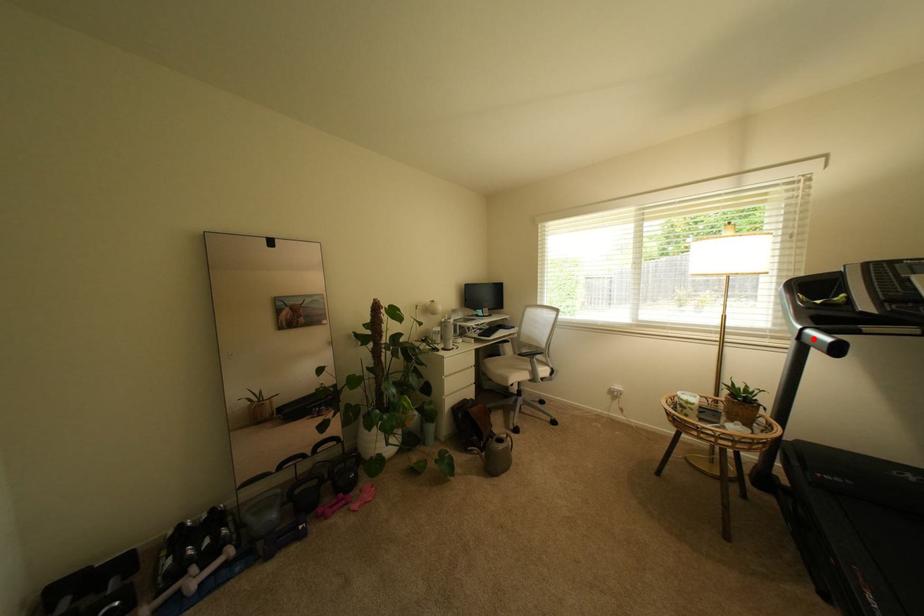
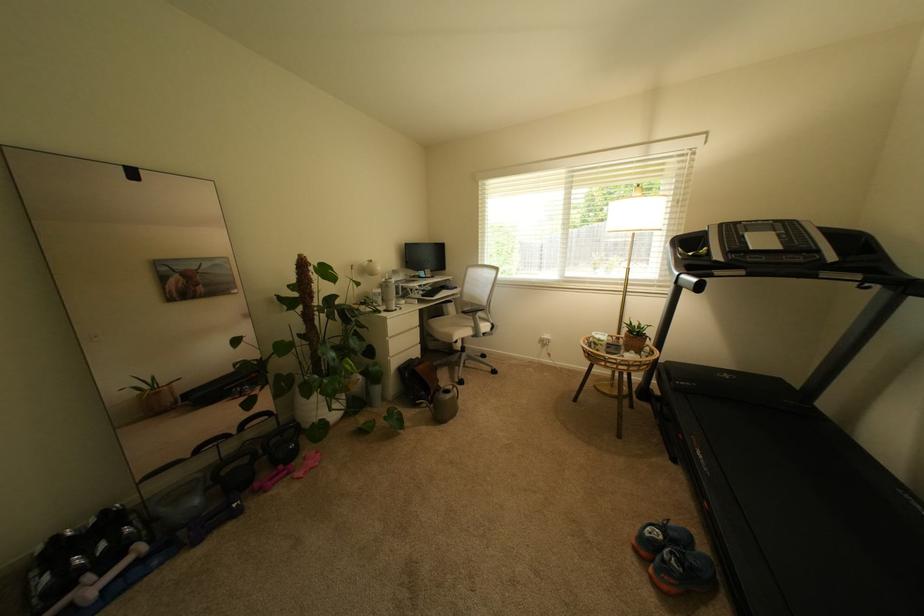
Question: I am providing you with two images of the same scene from different viewpoints. A red point is shown in image1. For the corresponding object point in image2, is it positioned nearer or farther from the camera?

Choices:
 (A) Nearer
 (B) Farther

Answer: (A)